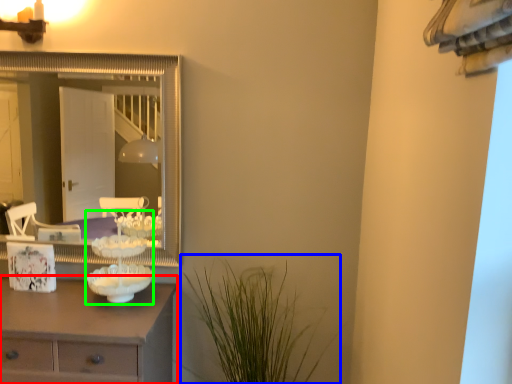
Question: Which object is positioned closest to chest of drawers (highlighted by a red box)? Select from plant (highlighted by a blue box) and candle holder (highlighted by a green box).

Choices:
 (A) plant
 (B) candle holder

Answer: (B)